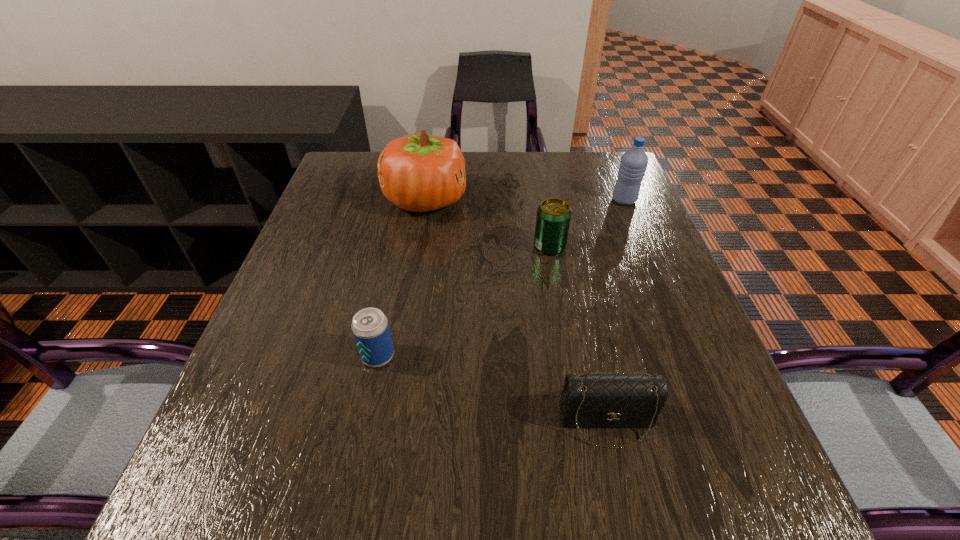
Find the location of a particular element. This screenshot has height=540, width=960. pumpkin is located at coordinates (419, 172).

Find the location of a particular element. the rightmost object is located at coordinates (633, 164).

You are a GUI agent. You are given a task and a screenshot of the screen. Output one action in this format:
    pyautogui.click(x=<x>, y=<y>)
    Task: Click on the farther beer can
    The height and width of the screenshot is (540, 960).
    Given the screenshot: What is the action you would take?
    pyautogui.click(x=553, y=218)

Locate an element on the screen. This screenshot has height=540, width=960. the right beer can is located at coordinates (553, 218).

Locate an element on the screen. The image size is (960, 540). the nearer beer can is located at coordinates (370, 327).

Where is `the second nearest object`? Image resolution: width=960 pixels, height=540 pixels. the second nearest object is located at coordinates (370, 327).

Identify the location of the nearest object. The image size is (960, 540). (593, 400).

Locate an element on the screen. vacant space situated 0.370m on the side of the pumpkin with the cute face is located at coordinates (602, 200).

At what (x,y) coordinates should I click in order to perform the action: click on free space located on the back of the rightmost object. Please return your answer as a coordinate pair (x, y). The image size is (960, 540). Looking at the image, I should click on (615, 178).

Where is `free spot located 0.280m on the left of the right beer can`? This screenshot has width=960, height=540. free spot located 0.280m on the left of the right beer can is located at coordinates (418, 247).